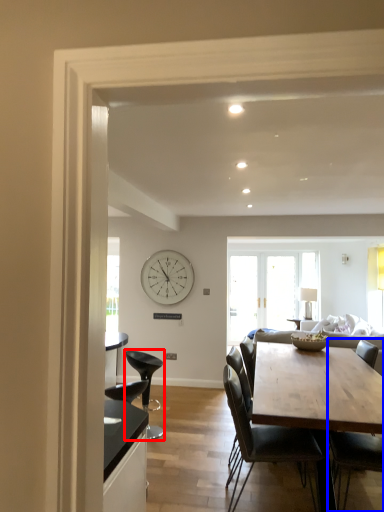
Question: Which of the following is the closest to the observer, chair (highlighted by a red box) or chair (highlighted by a blue box)?

Choices:
 (A) chair
 (B) chair

Answer: (B)